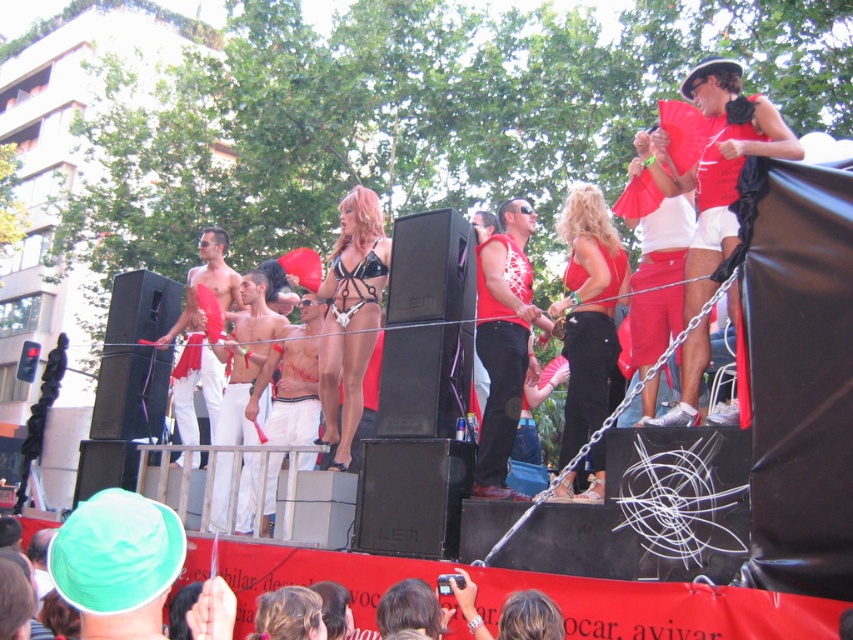
You are a photographer at the bottom edge of the image, aiming to capture the performers on stage. Which of the two items, the matte red bikini at center or the matte white shorts at center, will appear larger in your photo?

The matte red bikini at center will appear larger in the photo because it is closer to the viewer than the matte white shorts at center.

You are a photographer at the bottom edge of the frame, and you want to capture the shiny white shorts at center and matte white pants at center in your photo. Which of the two items will appear narrower in the photo?

The shiny white shorts at center will appear narrower in the photo since it has a lesser width compared to the matte white pants at center.